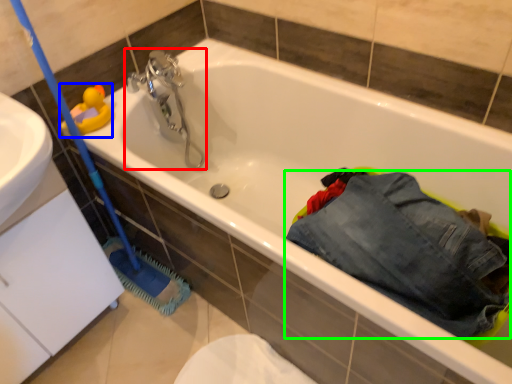
Question: Which is nearer to the tap (highlighted by a red box)? toy (highlighted by a blue box) or trousers (highlighted by a green box).

Choices:
 (A) toy
 (B) trousers

Answer: (A)